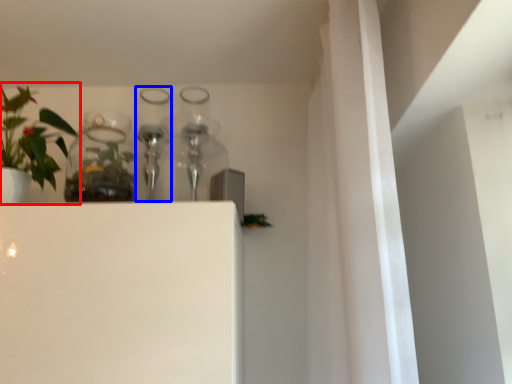
Question: Among these objects, which one is nearest to the camera, houseplant (highlighted by a red box) or bottle (highlighted by a blue box)?

Choices:
 (A) houseplant
 (B) bottle

Answer: (A)